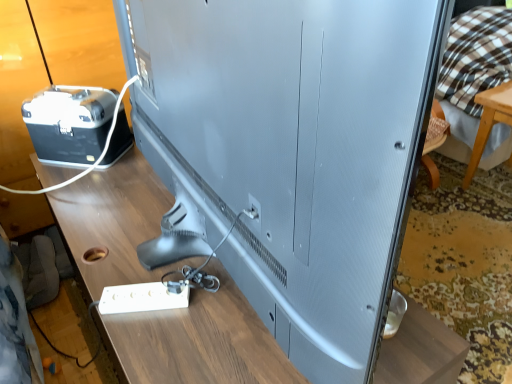
Identify the location of free spot above white plastic wire at left (from a real-world perspective). (75, 93).